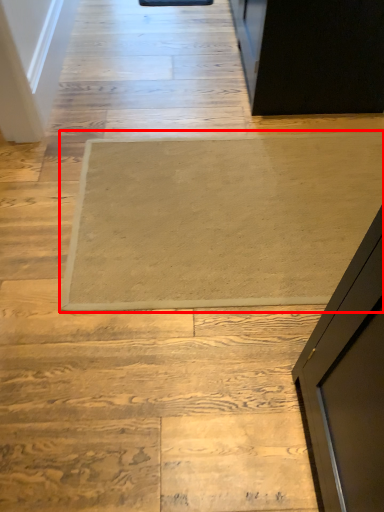
Question: In this image, where is mat (annotated by the red box) located relative to stairwell?

Choices:
 (A) left
 (B) right

Answer: (B)